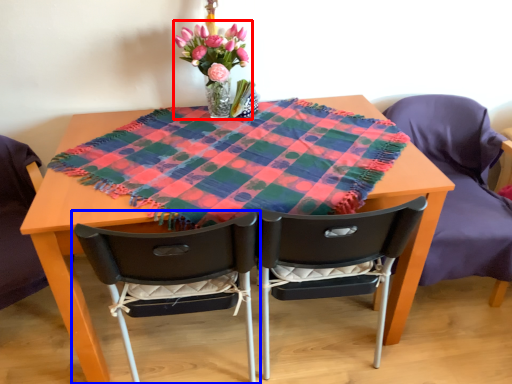
Question: Which object appears closest to the camera in this image, floral arrangement (highlighted by a red box) or chair (highlighted by a blue box)?

Choices:
 (A) floral arrangement
 (B) chair

Answer: (B)